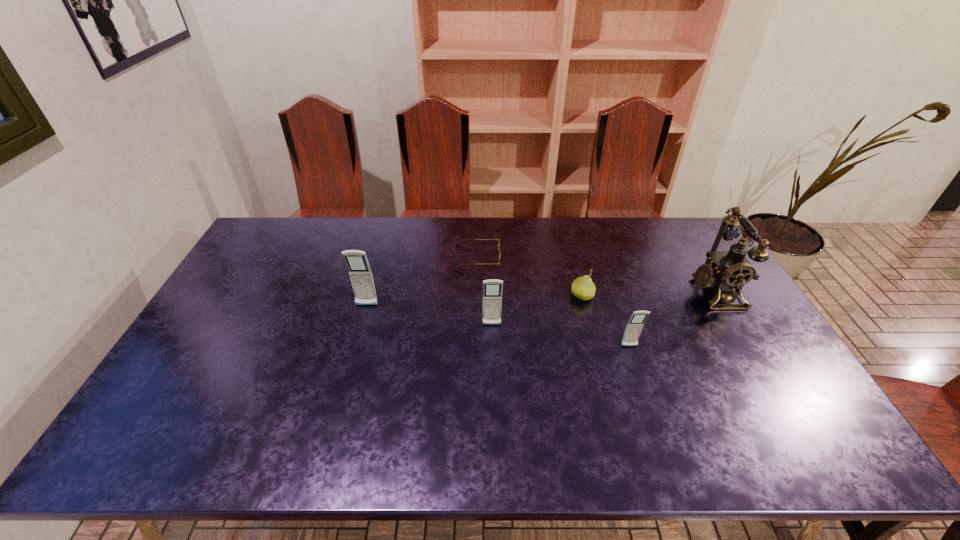
The width and height of the screenshot is (960, 540). Find the location of `the second closest cellular telephone to the shortest cellular telephone`. the second closest cellular telephone to the shortest cellular telephone is located at coordinates (360, 273).

Locate an element on the screen. Image resolution: width=960 pixels, height=540 pixels. vacant space that satisfies the following two spatial constraints: 1. on the front-facing side of the fifth tallest object; 2. on the right side of the shortest object is located at coordinates (477, 296).

At what (x,y) coordinates should I click in order to perform the action: click on free spot that satisfies the following two spatial constraints: 1. on the rotary dial of the rightmost object; 2. on the front-facing side of the tallest cellular telephone. Please return your answer as a coordinate pair (x, y). Looking at the image, I should click on (723, 306).

Find the location of a particular element. This screenshot has width=960, height=540. free space in the image that satisfies the following two spatial constraints: 1. on the rotary dial of the telephone; 2. on the front side of the fourth object from left to right is located at coordinates (717, 296).

The image size is (960, 540). Find the location of `vacant space that satisfies the following two spatial constraints: 1. on the front-facing side of the sunglasses; 2. on the front-facing side of the tallest cellular telephone`. vacant space that satisfies the following two spatial constraints: 1. on the front-facing side of the sunglasses; 2. on the front-facing side of the tallest cellular telephone is located at coordinates (477, 306).

This screenshot has width=960, height=540. I want to click on free space that satisfies the following two spatial constraints: 1. on the front-facing side of the fifth tallest object; 2. on the left side of the shortest object, so click(477, 296).

The image size is (960, 540). I want to click on vacant area that satisfies the following two spatial constraints: 1. on the front-facing side of the fourth object from left to right; 2. on the right side of the sunglasses, so click(477, 296).

The height and width of the screenshot is (540, 960). I want to click on vacant point that satisfies the following two spatial constraints: 1. on the rotary dial of the rightmost object; 2. on the front side of the fourth object from left to right, so click(717, 296).